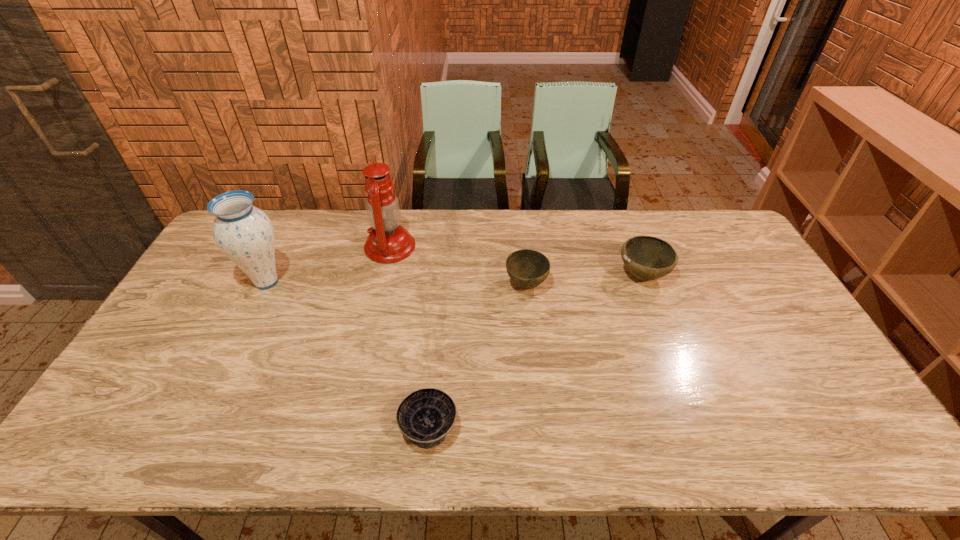
What are the coordinates of `vacant space located 0.390m on the left of the second bowl from left to right` in the screenshot? It's located at (382, 285).

You are a GUI agent. You are given a task and a screenshot of the screen. Output one action in this format:
    pyautogui.click(x=<x>, y=<y>)
    Task: Click on the vacant space located on the left of the shortest bowl
    
    Given the screenshot: What is the action you would take?
    pyautogui.click(x=358, y=427)

At what (x,y) coordinates should I click in order to perform the action: click on object present at the far edge. Please return your answer as a coordinate pair (x, y). The height and width of the screenshot is (540, 960). Looking at the image, I should click on (388, 242).

At what (x,y) coordinates should I click in order to perform the action: click on object located at the near edge. Please return your answer as a coordinate pair (x, y). Image resolution: width=960 pixels, height=540 pixels. Looking at the image, I should click on (426, 416).

Identify the location of object present at the left edge. (244, 233).

At what (x,y) coordinates should I click in order to perform the action: click on vacant region at the far edge of the desktop. Please return your answer as a coordinate pair (x, y). The image size is (960, 540). Looking at the image, I should click on (528, 215).

You are a GUI agent. You are given a task and a screenshot of the screen. Output one action in this format:
    pyautogui.click(x=<x>, y=<y>)
    Task: Click on the free space at the near edge of the desktop
    This screenshot has width=960, height=540.
    Given the screenshot: What is the action you would take?
    pyautogui.click(x=647, y=435)

Image resolution: width=960 pixels, height=540 pixels. In order to click on free space at the left edge in this screenshot , I will do `click(223, 305)`.

Find the location of a particular element. The image size is (960, 540). free space at the right edge is located at coordinates (768, 321).

In the image, there is a desktop. Where is `vacant space at the near left corner`? vacant space at the near left corner is located at coordinates (108, 455).